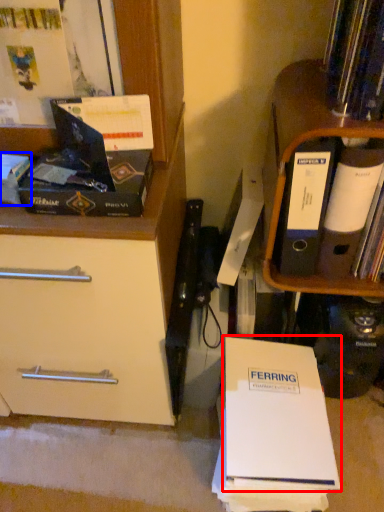
Question: Which object is closer to the camera taking this photo, paperback book (highlighted by a red box) or book (highlighted by a blue box)?

Choices:
 (A) paperback book
 (B) book

Answer: (B)